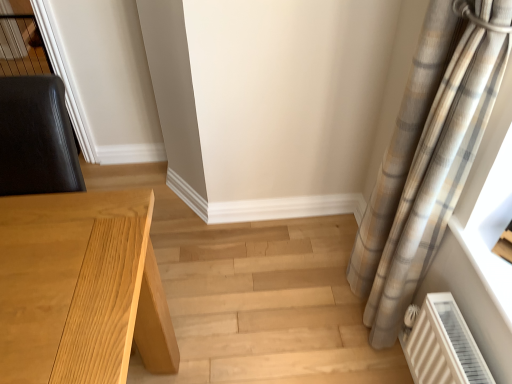
Locate an element on the screen. vacant region to the left of plaid fabric curtain at right is located at coordinates (310, 317).